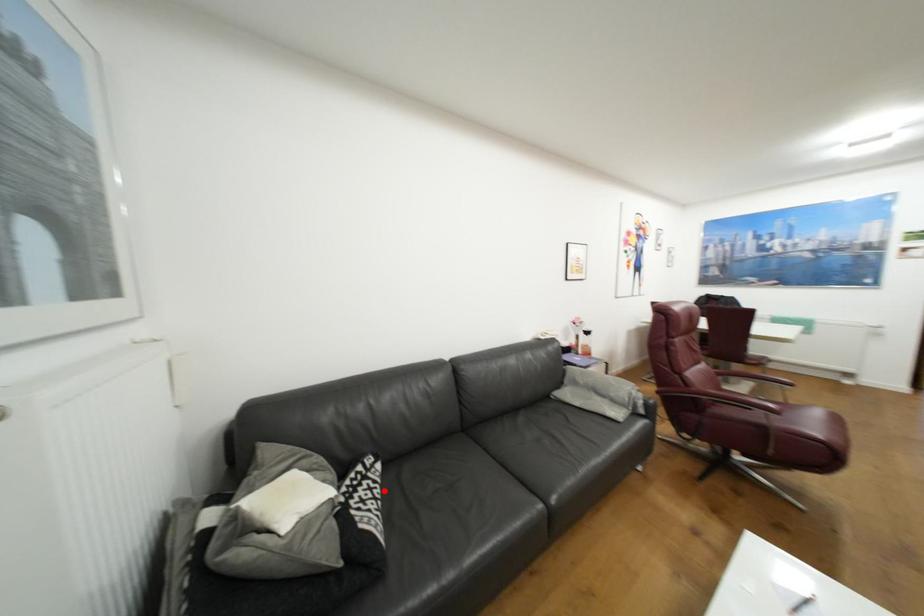
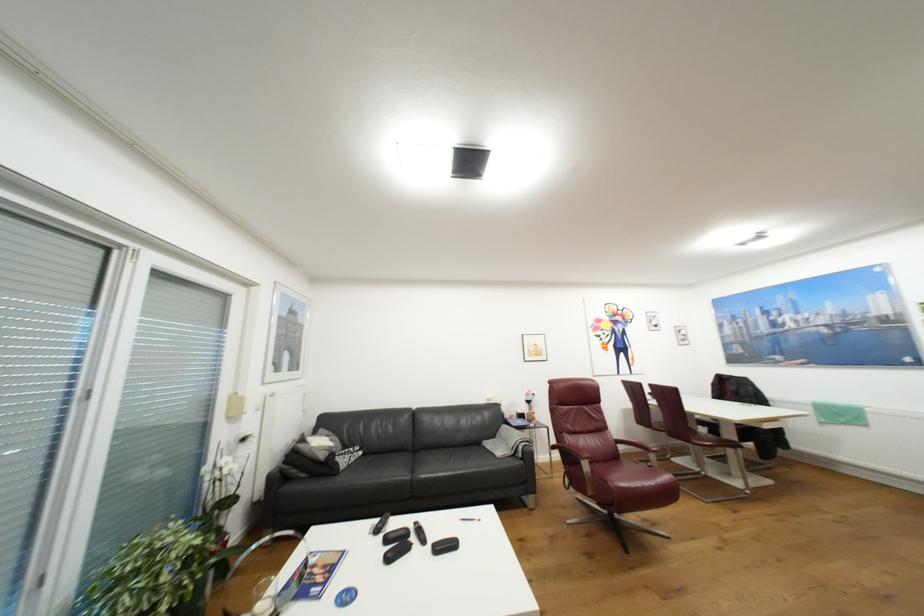
Question: I am providing you with two images of the same scene from different viewpoints. In image1, a red point is highlighted. Considering the same 3D point in image2, which of the following is correct?

Choices:
 (A) It is closer
 (B) It is farther

Answer: (B)